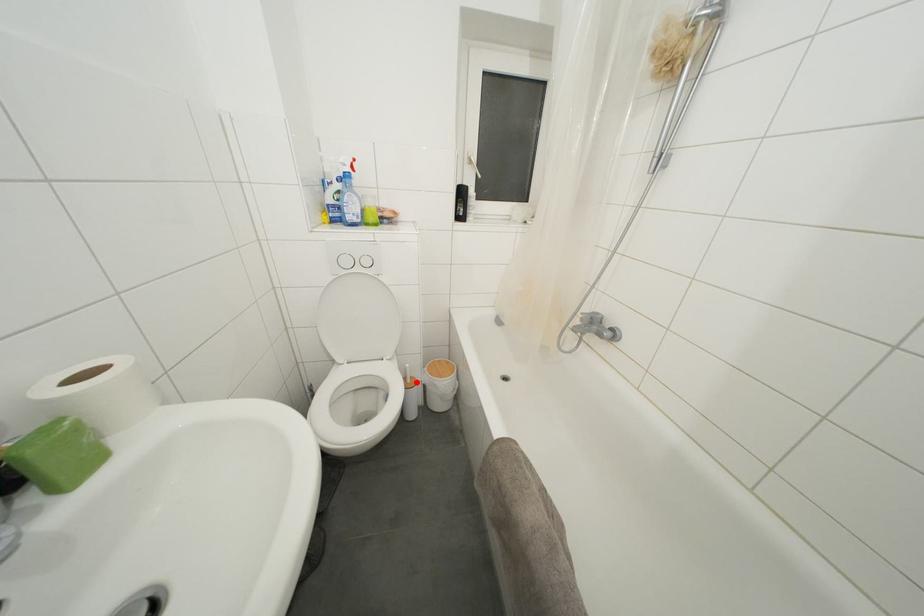
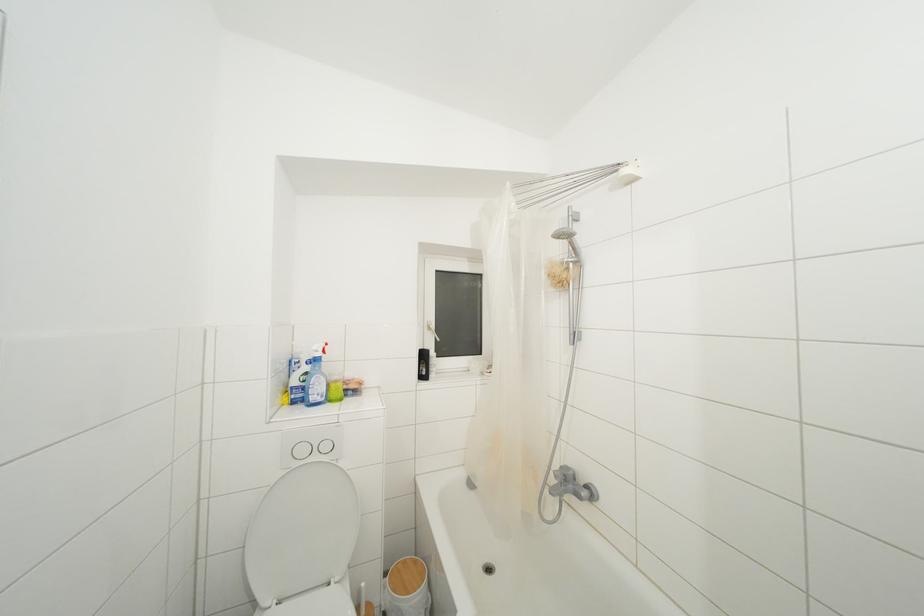
Locate, in the second image, the point that corresponds to the highlighted location in the first image.

(371, 610)